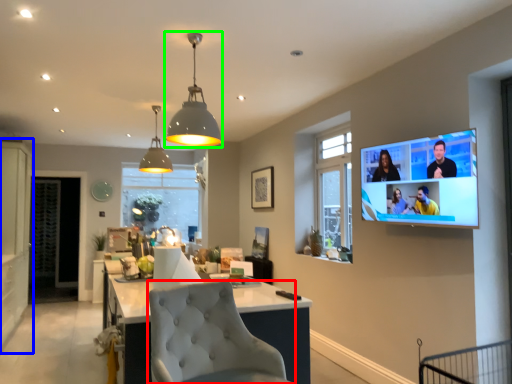
Question: Based on their relative distances, which object is nearer to chair (highlighted by a red box)? Choose from cabinetry (highlighted by a blue box) and light fixture (highlighted by a green box).

Choices:
 (A) cabinetry
 (B) light fixture

Answer: (B)